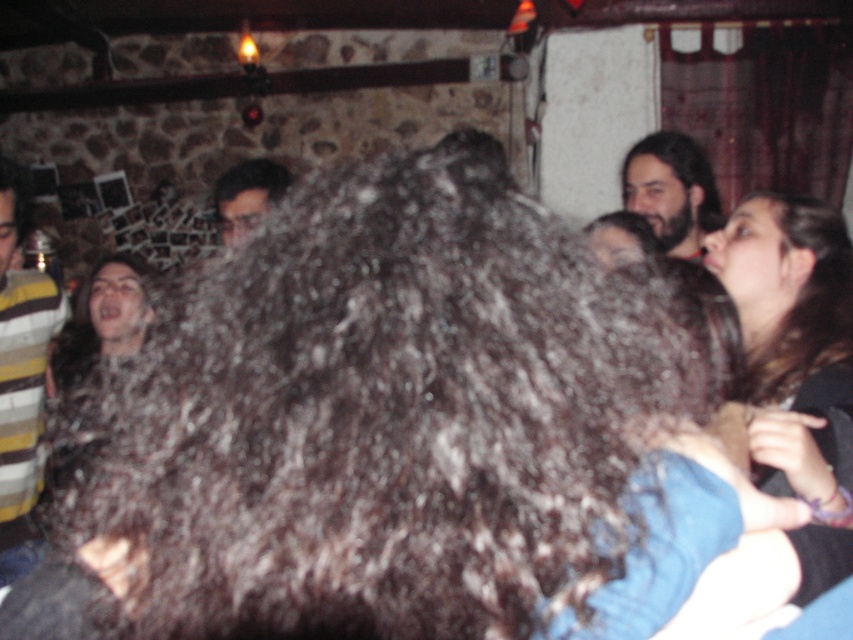
Which of these two, dark brown hair at upper right or matte black hair at center, stands taller?

Standing taller between the two is dark brown hair at upper right.

Is point (630, 179) positioned in front of point (282, 180)?

No, it is not.

At what (x,y) coordinates should I click in order to perform the action: click on dark brown hair at upper right. Please return your answer as a coordinate pair (x, y). Looking at the image, I should click on (671, 189).

Can you confirm if dark curly hair at center is positioned to the right of dark brown hair at upper right?

Incorrect, dark curly hair at center is not on the right side of dark brown hair at upper right.

Does dark curly hair at center have a lesser height compared to dark brown hair at upper right?

Yes.

Image resolution: width=853 pixels, height=640 pixels. What do you see at coordinates (387, 419) in the screenshot? I see `dark curly hair at center` at bounding box center [387, 419].

Locate an element on the screen. Image resolution: width=853 pixels, height=640 pixels. dark curly hair at center is located at coordinates (387, 419).

Is striped wool sweater at left bigger than matte black hair at center?

Yes, striped wool sweater at left is bigger than matte black hair at center.

This screenshot has width=853, height=640. What do you see at coordinates (20, 376) in the screenshot?
I see `striped wool sweater at left` at bounding box center [20, 376].

Between point (51, 316) and point (223, 189), which one is positioned behind?

The point (51, 316) is behind.

Identify the location of striped wool sweater at left. (20, 376).